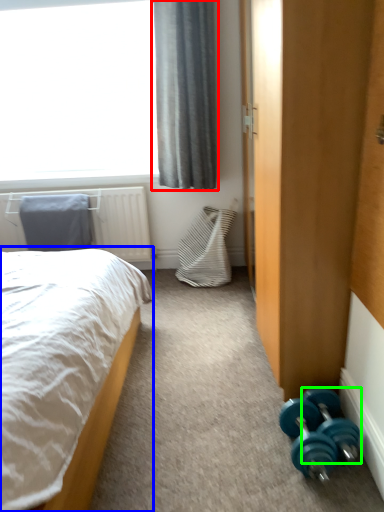
Question: Considering the real-world distances, which object is closest to curtain (highlighted by a red box)? bed (highlighted by a blue box) or dumbbell (highlighted by a green box).

Choices:
 (A) bed
 (B) dumbbell

Answer: (A)